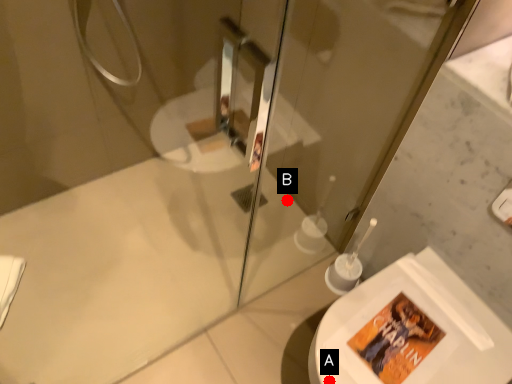
Question: Two points are circled on the image, labeled by A and B beside each circle. Among these points, which one is farthest from the camera?

Choices:
 (A) A is further
 (B) B is further

Answer: (B)